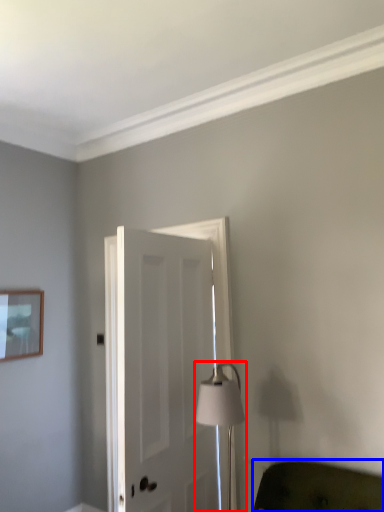
Question: Which of the following is the farthest to the observer, table lamp (highlighted by a red box) or furniture (highlighted by a blue box)?

Choices:
 (A) table lamp
 (B) furniture

Answer: (A)